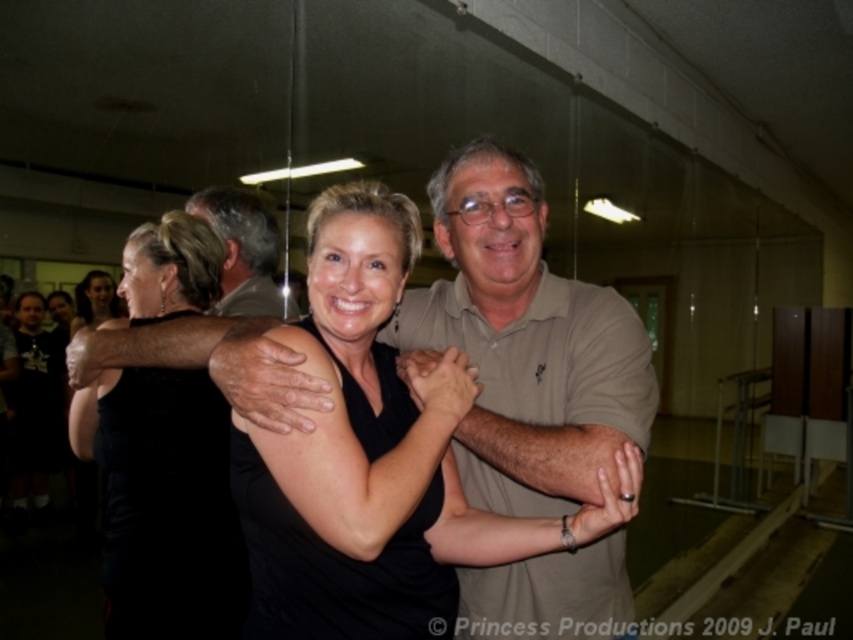
You are standing in the dance studio and want to move to the point at coordinates point (610, 371). If your reach is 3 feet, can you touch the point without moving your feet?

Answer: The point (610, 371) is 3.45 feet away from you, so you cannot touch it with a reach of 3 feet without moving your feet.

You are a photographer setting up for a dance class photo shoot in the studio. You need to ensure that all participants are visible in the frame. The black matte dress at center and the gray hair at upper left are two features you must consider. Which of these two features requires more space in the frame to be fully captured?

The black matte dress at center requires more space in the frame because its width is larger than the gray hair at upper left.

Looking at this image, you are a photographer setting up a camera in the dance studio. You notice the point at coordinates (524, 342) on your camera screen. What object is located at that point?

The point at coordinates (524, 342) marks the matte khaki polo shirt at center.